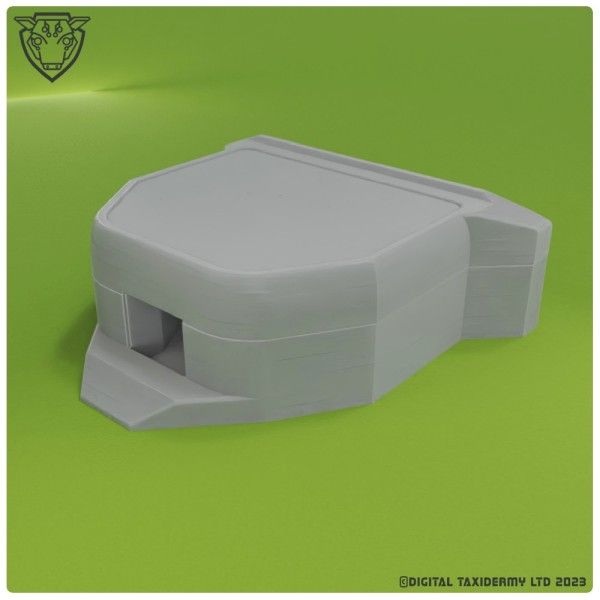
Where is `door/opening`? door/opening is located at coordinates (153, 337).